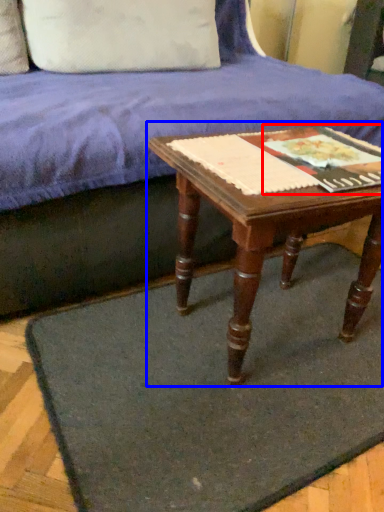
Question: Which object is further to the camera taking this photo, paperback book (highlighted by a red box) or table (highlighted by a blue box)?

Choices:
 (A) paperback book
 (B) table

Answer: (A)